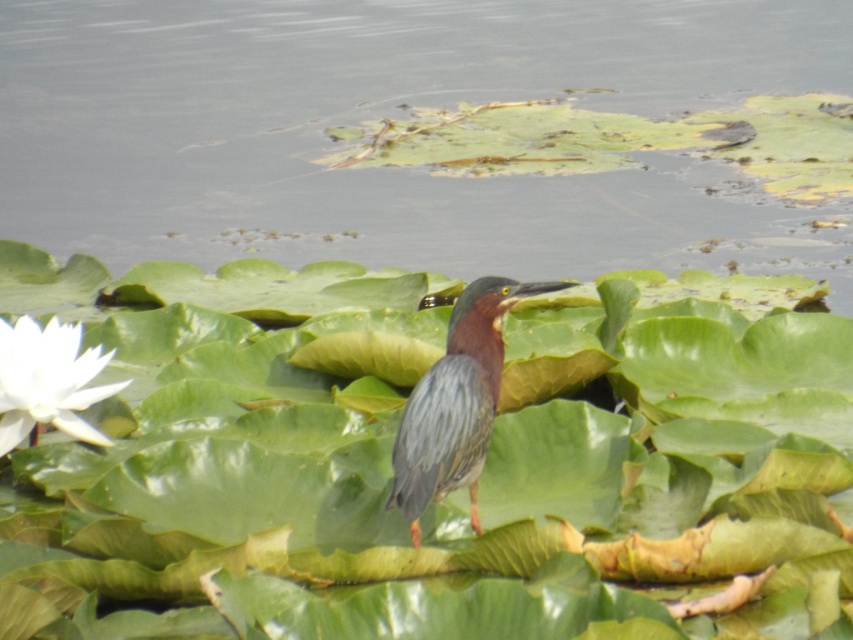
Which is below, clear water at center or green glossy heron at center?

green glossy heron at center

Can you confirm if clear water at center is wider than green glossy heron at center?

Correct, the width of clear water at center exceeds that of green glossy heron at center.

Between point (622, 177) and point (520, 285), which one is positioned in front?

Point (520, 285) is in front.

Find the location of a particular element. This screenshot has width=853, height=640. clear water at center is located at coordinates (393, 115).